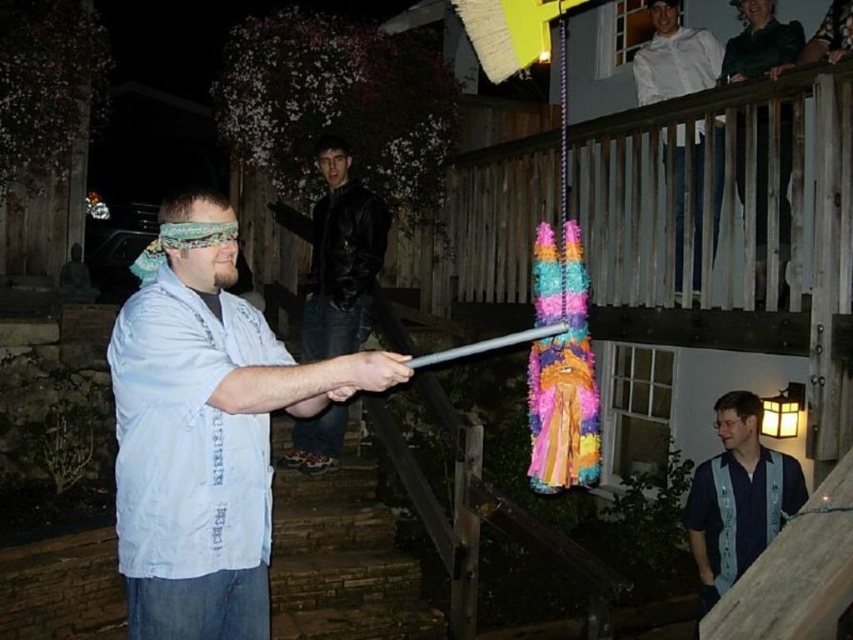
Question: Which is farther from the blue striped shirt at center?

Choices:
 (A) black leather jacket at upper center
 (B) white shirt at upper right
 (C) white cotton shirt at center

Answer: (C)

Question: Considering the real-world distances, which object is farthest from the blue striped shirt at center?

Choices:
 (A) white cotton shirt at center
 (B) black leather jacket at upper center

Answer: (A)

Question: Does white cotton shirt at center appear over black leather jacket at upper center?

Choices:
 (A) no
 (B) yes

Answer: (A)

Question: Which point is farther to the camera?

Choices:
 (A) tap(152, 541)
 (B) tap(354, 305)
 (C) tap(680, 51)
 (D) tap(769, 452)

Answer: (C)

Question: Is blue striped shirt at center bigger than white shirt at upper right?

Choices:
 (A) no
 (B) yes

Answer: (A)

Question: Considering the relative positions of white cotton shirt at center and blue striped shirt at center in the image provided, where is white cotton shirt at center located with respect to blue striped shirt at center?

Choices:
 (A) left
 (B) right

Answer: (A)